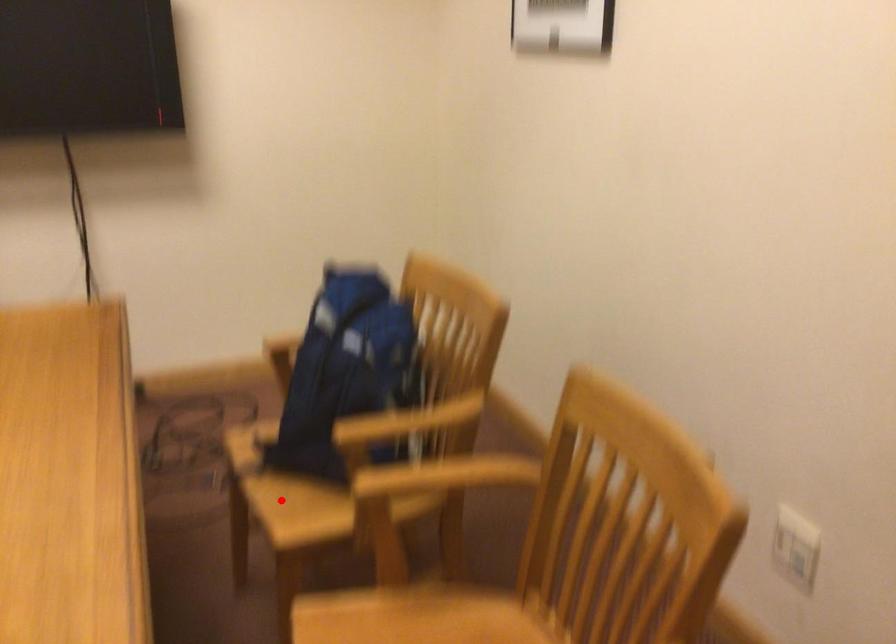
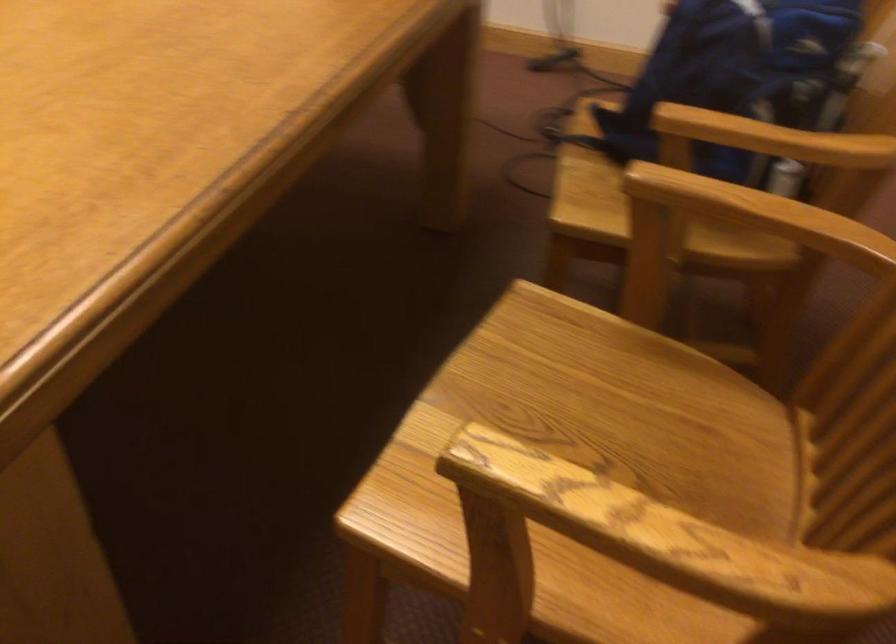
Find the pixel in the second image that matches the highlighted location in the first image.

(584, 187)